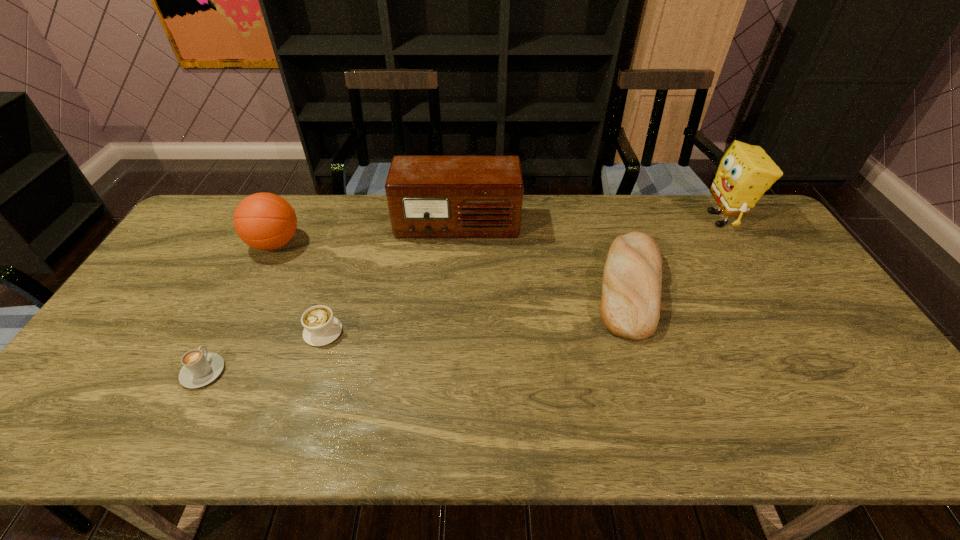
Locate an element on the screen. This screenshot has width=960, height=540. vacant space located 0.250m to the right of the nearest object is located at coordinates (249, 284).

This screenshot has width=960, height=540. In order to click on sponge located at the far edge in this screenshot , I will do `click(745, 172)`.

Find the location of a particular element. This screenshot has width=960, height=540. radio receiver located at the far edge is located at coordinates 428,196.

This screenshot has width=960, height=540. Find the location of `basketball that is at the far edge`. basketball that is at the far edge is located at coordinates (265, 221).

The width and height of the screenshot is (960, 540). In order to click on object at the right edge in this screenshot , I will do `click(745, 172)`.

This screenshot has width=960, height=540. I want to click on object at the far right corner, so click(745, 172).

At what (x,y) coordinates should I click in order to perform the action: click on vacant space at the far edge of the desktop. Please return your answer as a coordinate pair (x, y). The height and width of the screenshot is (540, 960). Looking at the image, I should click on point(622,223).

At what (x,y) coordinates should I click in order to perform the action: click on free space at the near edge of the desktop. Please return your answer as a coordinate pair (x, y). The width and height of the screenshot is (960, 540). Looking at the image, I should click on tap(822, 441).

The height and width of the screenshot is (540, 960). I want to click on vacant space at the left edge of the desktop, so click(102, 370).

Locate an element on the screen. The image size is (960, 540). vacant area at the right edge is located at coordinates (805, 301).